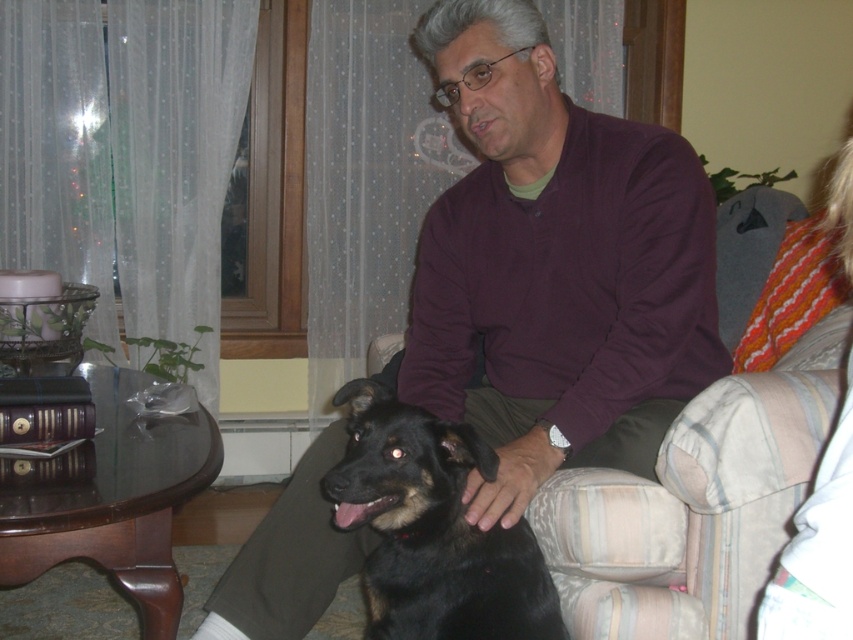
Is maroon sweater at center to the left of black fur dog at center from the viewer's perspective?

In fact, maroon sweater at center is to the right of black fur dog at center.

Which is in front, point (413, 42) or point (498, 612)?

Positioned in front is point (498, 612).

This screenshot has height=640, width=853. Describe the element at coordinates (554, 266) in the screenshot. I see `maroon sweater at center` at that location.

You are a GUI agent. You are given a task and a screenshot of the screen. Output one action in this format:
    pyautogui.click(x=<x>, y=<y>)
    Task: Click on the maroon sweater at center
    Image resolution: width=853 pixels, height=640 pixels.
    Given the screenshot: What is the action you would take?
    pyautogui.click(x=554, y=266)